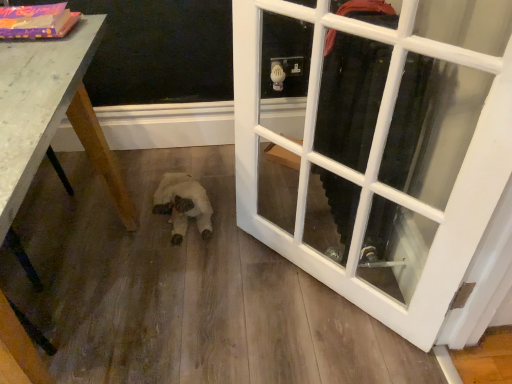
The width and height of the screenshot is (512, 384). What are the coordinates of `white glass door at center` in the screenshot? It's located at (x=383, y=148).

Describe the element at coordinates (183, 204) in the screenshot. I see `white plush toy at center` at that location.

At what (x,y) coordinates should I click in order to perform the action: click on wooden table at lower left. Please return your answer as a coordinate pair (x, y). This screenshot has width=512, height=384. Looking at the image, I should click on (50, 115).

Identify the location of white glass door at center. The height and width of the screenshot is (384, 512). (383, 148).

Can you confirm if wooden table at lower left is smaller than white glass door at center?

Actually, wooden table at lower left might be larger than white glass door at center.

Which object is wider, wooden table at lower left or white glass door at center?

With larger width is wooden table at lower left.

Consider the image. From the image's perspective, is wooden table at lower left beneath white glass door at center?

Yes, from the image's perspective, wooden table at lower left is below white glass door at center.

Is wooden table at lower left not near white glass door at center?

No, wooden table at lower left is in close proximity to white glass door at center.

Does point (470, 34) come behind point (37, 70)?

Yes, point (470, 34) is farther from viewer.

Considering the positions of objects white glass door at center and wooden table at lower left in the image provided, who is more to the left, white glass door at center or wooden table at lower left?

From the viewer's perspective, wooden table at lower left appears more on the left side.

Is white glass door at center positioned beyond the bounds of wooden table at lower left?

Yes, white glass door at center is outside of wooden table at lower left.

Considering the positions of objects white glass door at center and wooden table at lower left in the image provided, who is in front, white glass door at center or wooden table at lower left?

Positioned in front is wooden table at lower left.

From the image's perspective, is white glass door at center above white plush toy at center?

Yes, from the image's perspective, white glass door at center is over white plush toy at center.

Is white glass door at center positioned in front of white plush toy at center?

Yes, it is.

Could white plush toy at center be considered to be inside white glass door at center?

No, white plush toy at center is not surrounded by white glass door at center.

Who is shorter, white glass door at center or white plush toy at center?

With less height is white plush toy at center.

Which is behind, wooden table at lower left or white plush toy at center?

white plush toy at center is further from the camera.

Can you confirm if wooden table at lower left is shorter than white plush toy at center?

No, wooden table at lower left is not shorter than white plush toy at center.

From a real-world perspective, between wooden table at lower left and white plush toy at center, who is vertically higher?

From a 3D spatial view, wooden table at lower left is above.

Considering the positions of objects white plush toy at center and white glass door at center in the image provided, who is more to the right, white plush toy at center or white glass door at center?

white glass door at center is more to the right.

Find the location of a particular element. This screenshot has width=512, height=384. animal that appears on the left of white glass door at center is located at coordinates (183, 204).

How far apart are white plush toy at center and white glass door at center?

white plush toy at center and white glass door at center are 22.57 inches apart from each other.

From the image's perspective, which one is positioned lower, white plush toy at center or white glass door at center?

white plush toy at center.

Is white plush toy at center taller or shorter than wooden table at lower left?

Clearly, white plush toy at center is shorter compared to wooden table at lower left.

Based on their positions, is white plush toy at center located to the left or right of wooden table at lower left?

white plush toy at center is to the right of wooden table at lower left.

Image resolution: width=512 pixels, height=384 pixels. Identify the location of animal behind the wooden table at lower left. (183, 204).

Does white plush toy at center turn towards wooden table at lower left?

No, white plush toy at center is not facing towards wooden table at lower left.

At what (x,y) coordinates should I click in order to perform the action: click on table beneath the white glass door at center (from a real-world perspective). Please return your answer as a coordinate pair (x, y). The image size is (512, 384). Looking at the image, I should click on (50, 115).

This screenshot has width=512, height=384. Find the location of `table in front of the white glass door at center`. table in front of the white glass door at center is located at coordinates (50, 115).

When comparing their distances from white glass door at center, does white plush toy at center or wooden table at lower left seem closer?

white plush toy at center lies closer to white glass door at center than the other object.

When comparing their distances from white plush toy at center, does white glass door at center or wooden table at lower left seem closer?

wooden table at lower left is closer to white plush toy at center.

Considering their positions, is wooden table at lower left positioned closer to white plush toy at center than white glass door at center?

Based on the image, wooden table at lower left appears to be nearer to white plush toy at center.

Which object lies nearer to the anchor point white glass door at center, wooden table at lower left or white plush toy at center?

Among the two, white plush toy at center is located nearer to white glass door at center.

Which object lies nearer to the anchor point wooden table at lower left, white glass door at center or white plush toy at center?

white plush toy at center lies closer to wooden table at lower left than the other object.

Which object lies further to the anchor point wooden table at lower left, white plush toy at center or white glass door at center?

white glass door at center.

Where is `door between wooden table at lower left and white plush toy at center along the z-axis`? door between wooden table at lower left and white plush toy at center along the z-axis is located at coordinates coord(383,148).